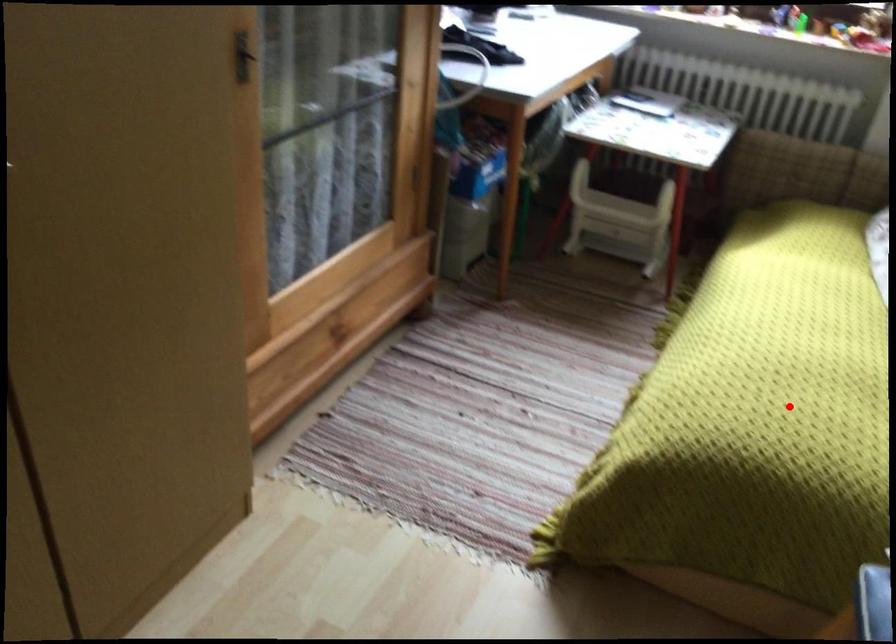
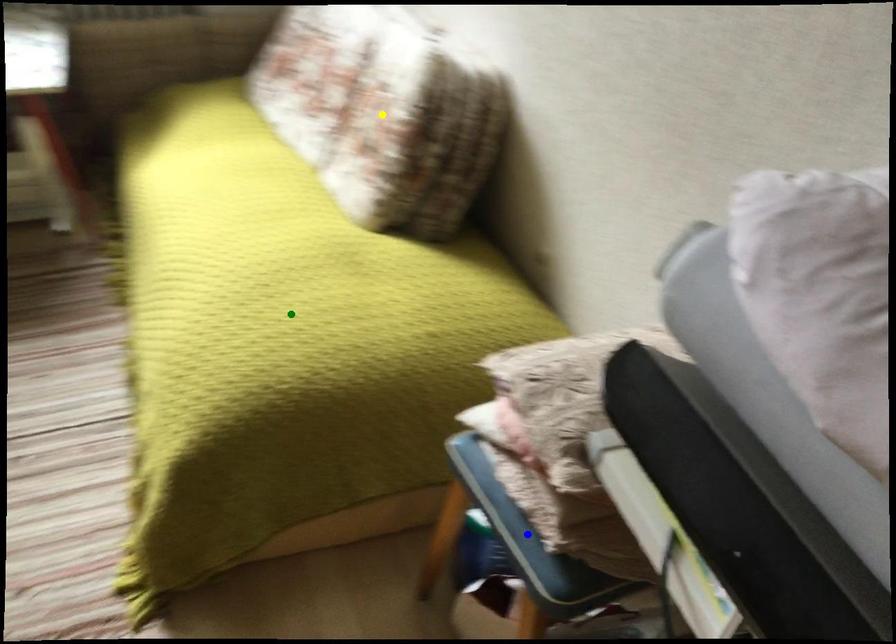
Question: I am providing you with two images of the same scene from different viewpoints. A red point is marked on the first image. You are given multiple points on the second image. Which point in image 2 is actually the same real-world point as the red point in image 1?

Choices:
 (A) blue point
 (B) yellow point
 (C) green point

Answer: (C)